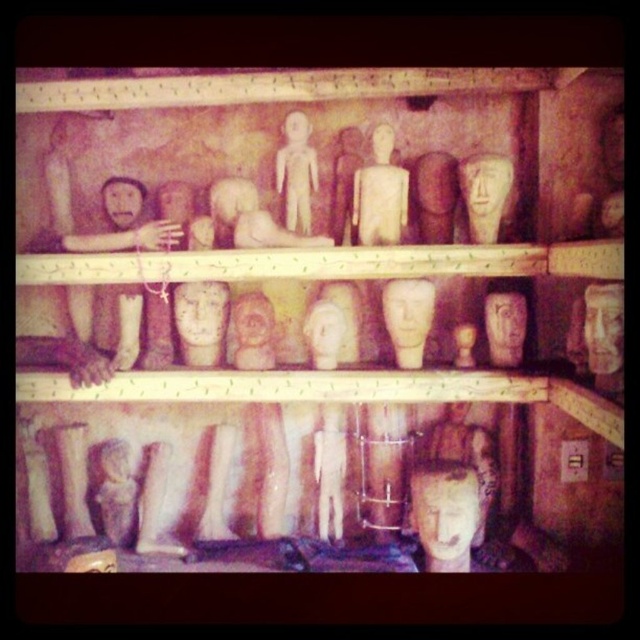
Question: Which object is the farthest from the matte wood figure at center?

Choices:
 (A) matte wooden mask at center
 (B) matte wood mask at center

Answer: (A)

Question: Is matte wood mask at center-right wider than matte clay mask at center?

Choices:
 (A) yes
 (B) no

Answer: (B)

Question: Which object appears farthest from the camera in this image?

Choices:
 (A) matte clay mask at center
 (B) matte wood figure at center
 (C) matte wood mask at center-right

Answer: (A)

Question: Can you confirm if matte wooden figure at upper center is wider than matte clay mask at center?

Choices:
 (A) no
 (B) yes

Answer: (A)

Question: Which is nearer to the matte clay mask at center?

Choices:
 (A) matte wooden figure at upper center
 (B) matte wood mask at upper right

Answer: (A)

Question: Is matte wood figure at center smaller than matte wooden mask at center?

Choices:
 (A) no
 (B) yes

Answer: (A)